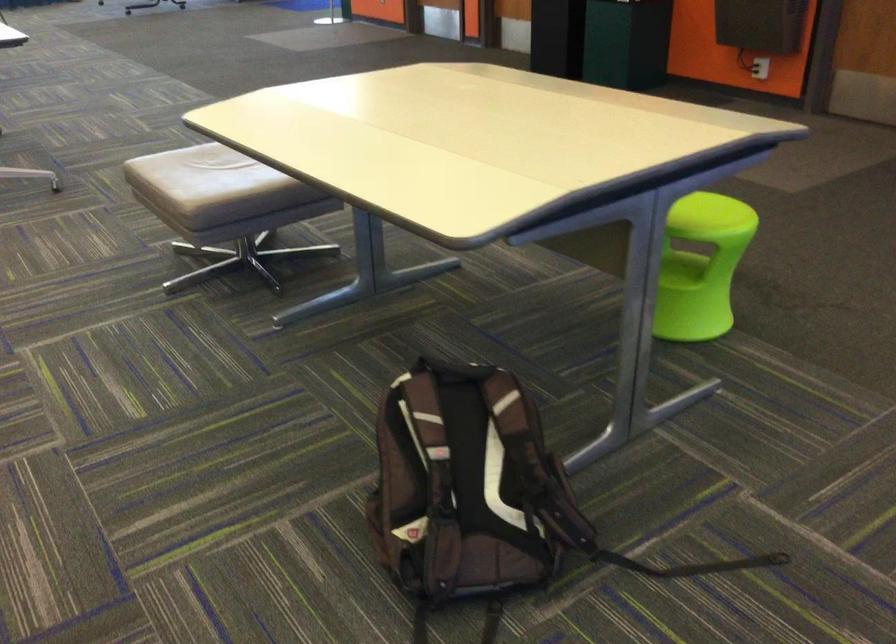
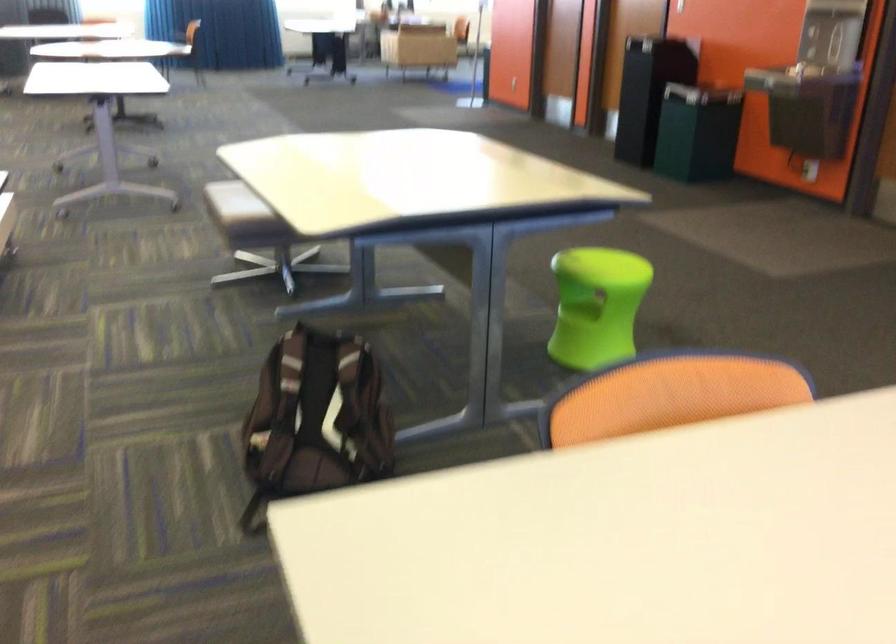
Which direction would the cameraman need to move to produce the second image?

The cameraman walked toward right, backward.